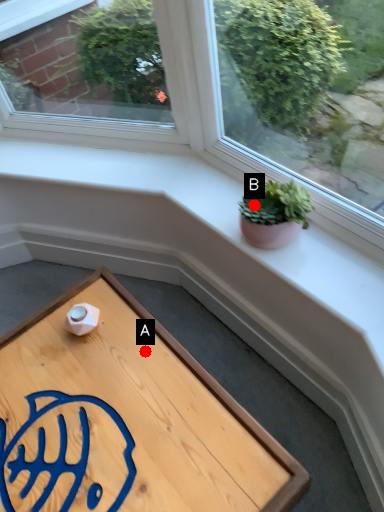
Question: Two points are circled on the image, labeled by A and B beside each circle. Which point appears closest to the camera in this image?

Choices:
 (A) A is closer
 (B) B is closer

Answer: (B)